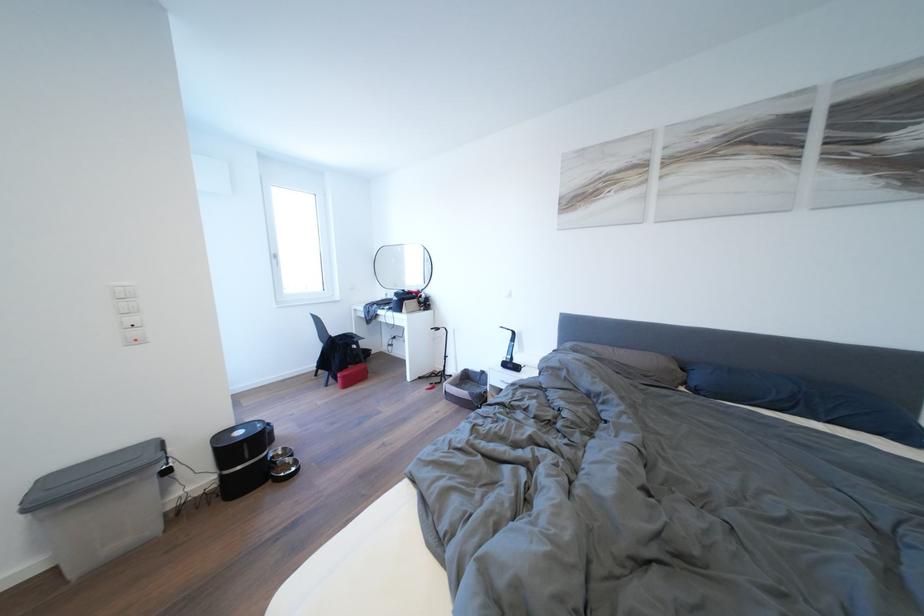
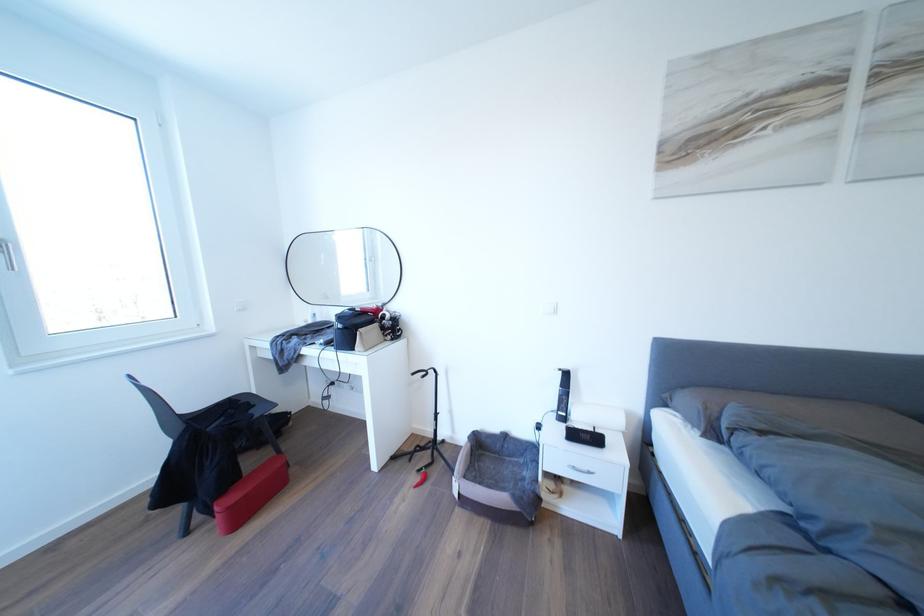
The point at (388, 300) is marked in the first image. Where is the corresponding point in the second image?

(310, 322)